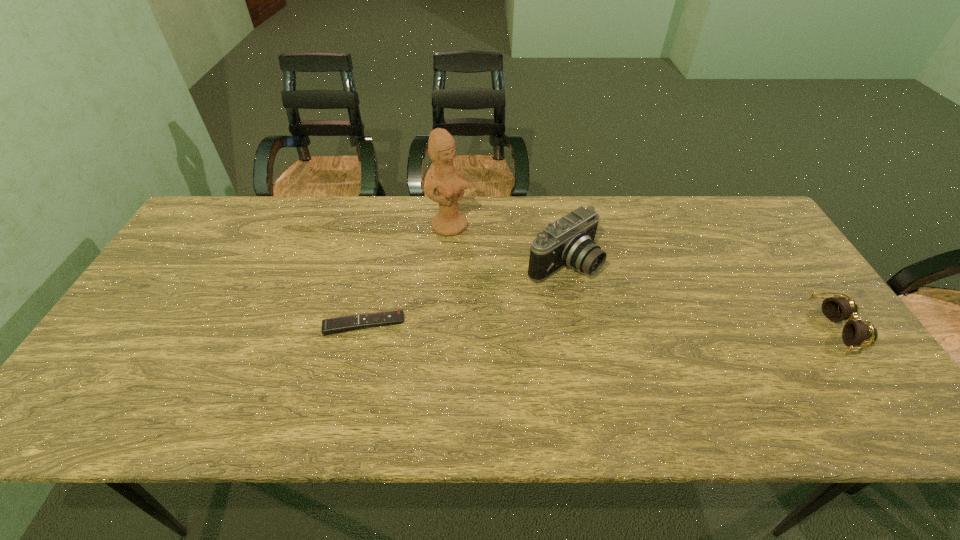
What are the coordinates of `vacant space situated 0.350m on the front-facing side of the farthest object` in the screenshot? It's located at (545, 301).

At what (x,y) coordinates should I click in order to perform the action: click on free region located on the front-facing side of the farthest object. Please return your answer as a coordinate pair (x, y). Looking at the image, I should click on (503, 267).

What are the coordinates of `free region located 0.250m on the front-facing side of the third shortest object` in the screenshot? It's located at coord(668,336).

You are a GUI agent. You are given a task and a screenshot of the screen. Output one action in this format:
    pyautogui.click(x=<x>, y=<y>)
    Task: Click on the vacant space situated on the front-facing side of the third shortest object
    The image size is (960, 540).
    Given the screenshot: What is the action you would take?
    pyautogui.click(x=658, y=329)

The height and width of the screenshot is (540, 960). Identify the location of vacant area situated 0.250m on the front-facing side of the third shortest object. (668, 336).

Find the location of a particular element. The image size is (960, 540). figurine that is positioned at the far edge is located at coordinates (449, 182).

What are the coordinates of `camera that is at the far edge` in the screenshot? It's located at (569, 241).

You are a GUI agent. You are given a task and a screenshot of the screen. Output one action in this format:
    pyautogui.click(x=<x>, y=<y>)
    Task: Click on the object that is at the near edge
    This screenshot has width=960, height=540.
    Given the screenshot: What is the action you would take?
    pyautogui.click(x=836, y=309)

The width and height of the screenshot is (960, 540). Find the location of `object present at the right edge`. object present at the right edge is located at coordinates (836, 309).

You are a GUI agent. You are given a task and a screenshot of the screen. Output one action in this format:
    pyautogui.click(x=<x>, y=<y>)
    Task: Click on the object that is positioned at the near right corner
    
    Given the screenshot: What is the action you would take?
    click(836, 309)